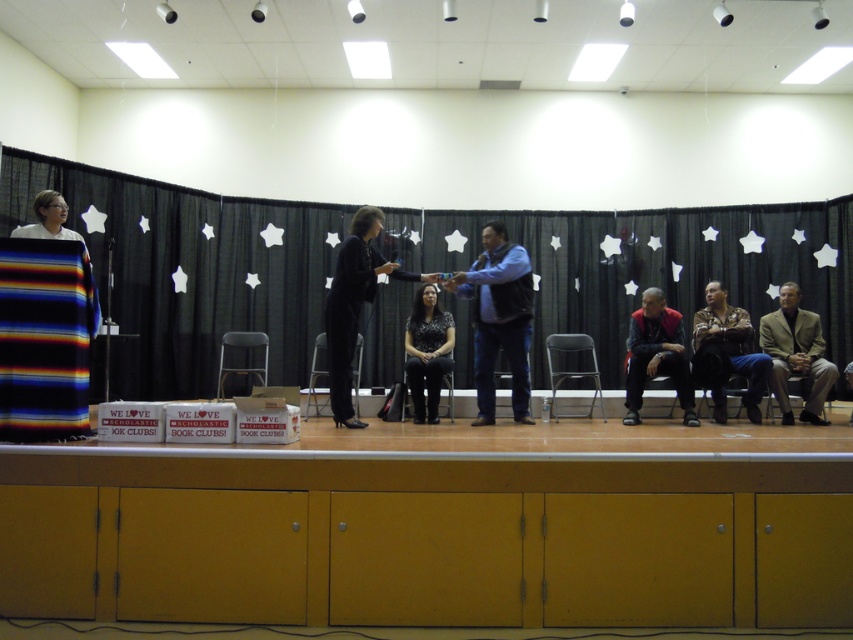
Question: Is black fabric curtain at upper center to the right of metallic silver chair at center from the viewer's perspective?

Choices:
 (A) no
 (B) yes

Answer: (A)

Question: Which point is farther to the camera?

Choices:
 (A) metallic silver chair at center
 (B) metallic gray chair at center
 (C) black satin dress at center
 (D) black plastic chair at center

Answer: (A)

Question: Does metallic gray chair at center appear over dark brown leather chair at lower right?

Choices:
 (A) yes
 (B) no

Answer: (B)

Question: Can you confirm if black fabric curtain at upper center is positioned above black fabric chair at center?

Choices:
 (A) yes
 (B) no

Answer: (A)

Question: Based on their relative distances, which object is nearer to the black fabric chair at lower right?

Choices:
 (A) black plastic chair at center
 (B) black matte dress at center
 (C) black satin dress at center

Answer: (C)

Question: Which is nearer to the dark gray sweater at center?

Choices:
 (A) black plastic chair at center
 (B) light brown leather jacket at right

Answer: (B)